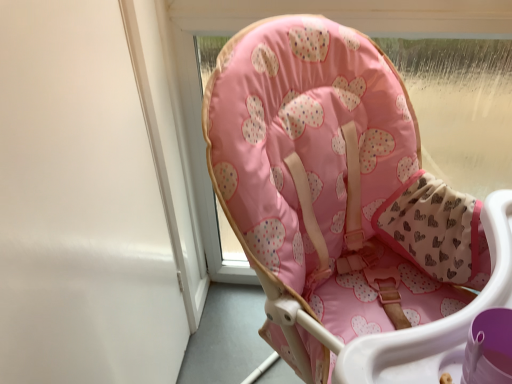
The image size is (512, 384). What do you see at coordinates (80, 206) in the screenshot? I see `white matte screen door at upper left` at bounding box center [80, 206].

Measure the distance between point (169, 239) and camera.

Point (169, 239) and camera are 1.08 meters apart from each other.

Locate an element on the screen. The image size is (512, 384). white matte screen door at upper left is located at coordinates (80, 206).

Locate an element on the screen. pink fabric baby chair at center is located at coordinates (336, 180).

What is the approximate height of pink fabric baby chair at center?

It is 3.31 feet.

This screenshot has height=384, width=512. What do you see at coordinates (336, 180) in the screenshot?
I see `pink fabric baby chair at center` at bounding box center [336, 180].

Find the location of a particular element. This screenshot has width=512, height=384. white matte screen door at upper left is located at coordinates (80, 206).

Visually, is white matte screen door at upper left positioned to the left or to the right of pink fabric baby chair at center?

Based on their positions, white matte screen door at upper left is located to the left of pink fabric baby chair at center.

Considering the positions of objects white matte screen door at upper left and pink fabric baby chair at center in the image provided, who is behind, white matte screen door at upper left or pink fabric baby chair at center?

white matte screen door at upper left is further from the camera.

Is point (83, 221) closer or farther from the camera than point (431, 228)?

Point (83, 221) is positioned closer to the camera compared to point (431, 228).

From the image's perspective, is white matte screen door at upper left positioned above or below pink fabric baby chair at center?

Based on their image positions, white matte screen door at upper left is located above pink fabric baby chair at center.

From a real-world perspective, is white matte screen door at upper left positioned under pink fabric baby chair at center based on gravity?

Incorrect, from a real-world perspective, white matte screen door at upper left is higher than pink fabric baby chair at center.

Considering the sizes of white matte screen door at upper left and pink fabric baby chair at center in the image, is white matte screen door at upper left wider or thinner than pink fabric baby chair at center?

In the image, white matte screen door at upper left appears to be more narrow than pink fabric baby chair at center.

Between white matte screen door at upper left and pink fabric baby chair at center, which one has more height?

With more height is pink fabric baby chair at center.

Between white matte screen door at upper left and pink fabric baby chair at center, which one has larger size?

pink fabric baby chair at center is bigger.

Is white matte screen door at upper left located outside pink fabric baby chair at center?

Yes, white matte screen door at upper left is not within pink fabric baby chair at center.

Are white matte screen door at upper left and pink fabric baby chair at center located far from each other?

No, white matte screen door at upper left is not far from pink fabric baby chair at center.

Is white matte screen door at upper left facing away from pink fabric baby chair at center?

Yes.

How many degrees apart are the facing directions of white matte screen door at upper left and pink fabric baby chair at center?

41.9 degrees.

How much distance is there between white matte screen door at upper left and pink fabric baby chair at center?

A distance of 14.28 inches exists between white matte screen door at upper left and pink fabric baby chair at center.

The image size is (512, 384). In order to click on chair located on the right of white matte screen door at upper left in this screenshot , I will do `click(336, 180)`.

Between pink fabric baby chair at center and white matte screen door at upper left, which one appears on the right side from the viewer's perspective?

Positioned to the right is pink fabric baby chair at center.

Which object is closer to the camera taking this photo, pink fabric baby chair at center or white matte screen door at upper left?

Positioned in front is pink fabric baby chair at center.

Is point (410, 213) farther from camera compared to point (155, 344)?

No, it is in front of (155, 344).

From the image's perspective, is pink fabric baby chair at center above white matte screen door at upper left?

No.

From a real-world perspective, between pink fabric baby chair at center and white matte screen door at upper left, who is vertically higher?

From a 3D spatial view, white matte screen door at upper left is above.

Consider the image. Can you confirm if pink fabric baby chair at center is thinner than white matte screen door at upper left?

No, pink fabric baby chair at center is not thinner than white matte screen door at upper left.

From their relative heights in the image, would you say pink fabric baby chair at center is taller or shorter than white matte screen door at upper left?

Clearly, pink fabric baby chair at center is taller compared to white matte screen door at upper left.

Is pink fabric baby chair at center bigger than white matte screen door at upper left?

Indeed, pink fabric baby chair at center has a larger size compared to white matte screen door at upper left.

Is white matte screen door at upper left located within pink fabric baby chair at center?

No.

Are pink fabric baby chair at center and white matte screen door at upper left far apart?

That's not correct — pink fabric baby chair at center is a little close to white matte screen door at upper left.

Based on the photo, is pink fabric baby chair at center aimed at white matte screen door at upper left?

No, pink fabric baby chair at center is not turned towards white matte screen door at upper left.

Measure the distance between pink fabric baby chair at center and white matte screen door at upper left.

The distance of pink fabric baby chair at center from white matte screen door at upper left is 14.28 inches.

Find the location of a particular element. The height and width of the screenshot is (384, 512). screen door above the pink fabric baby chair at center (from a real-world perspective) is located at coordinates (80, 206).

I want to click on screen door behind the pink fabric baby chair at center, so click(80, 206).

In the image, there is a pink fabric baby chair at center. Where is `screen door above it (from the image's perspective)`? screen door above it (from the image's perspective) is located at coordinates (80, 206).